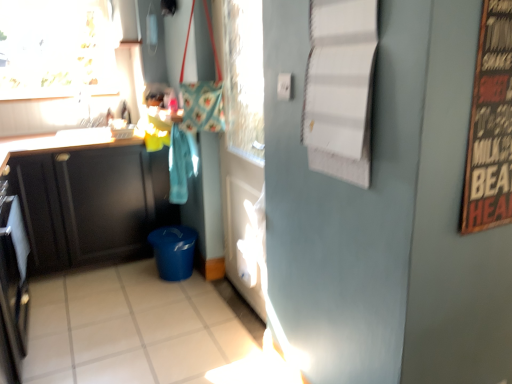
I want to click on free region under matte black cabinet at left, the first cabinetry from the front (from a real-world perspective), so click(114, 317).